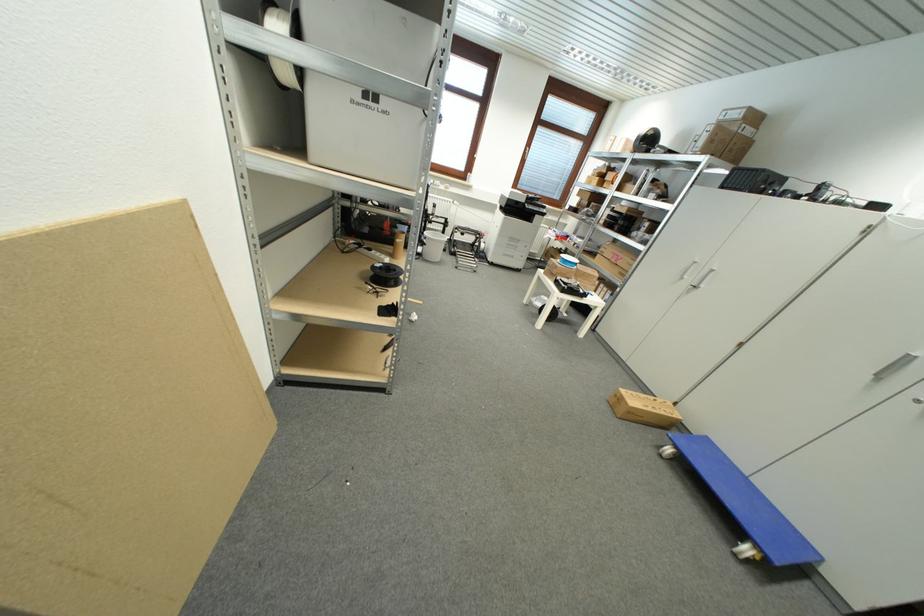
The image size is (924, 616). What do you see at coordinates (752, 180) in the screenshot? I see `the printer top cover` at bounding box center [752, 180].